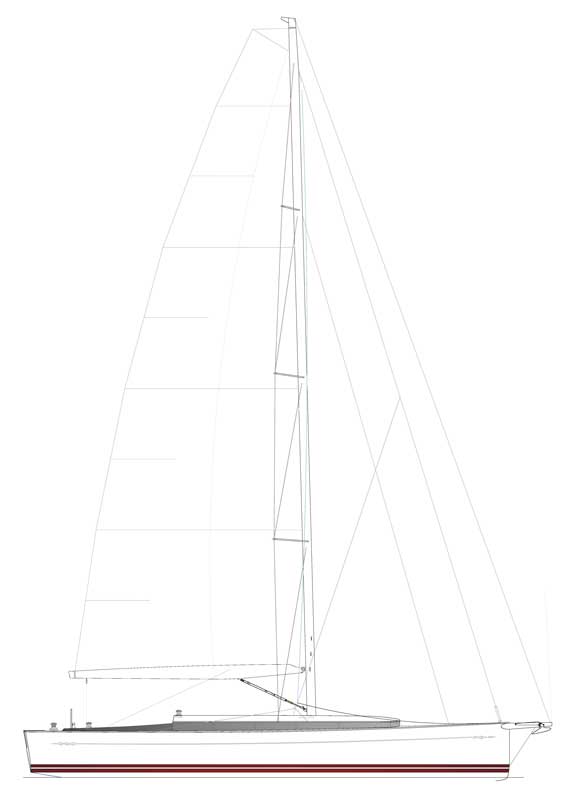
Find the location of a particular element. This screenshot has height=800, width=573. vertical pole in middle is located at coordinates (310, 638).